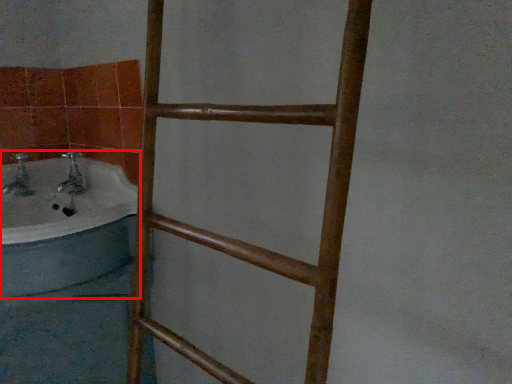
Question: From the image, what is the correct spatial relationship of bathtub (annotated by the red box) in relation to ladder?

Choices:
 (A) right
 (B) left

Answer: (B)